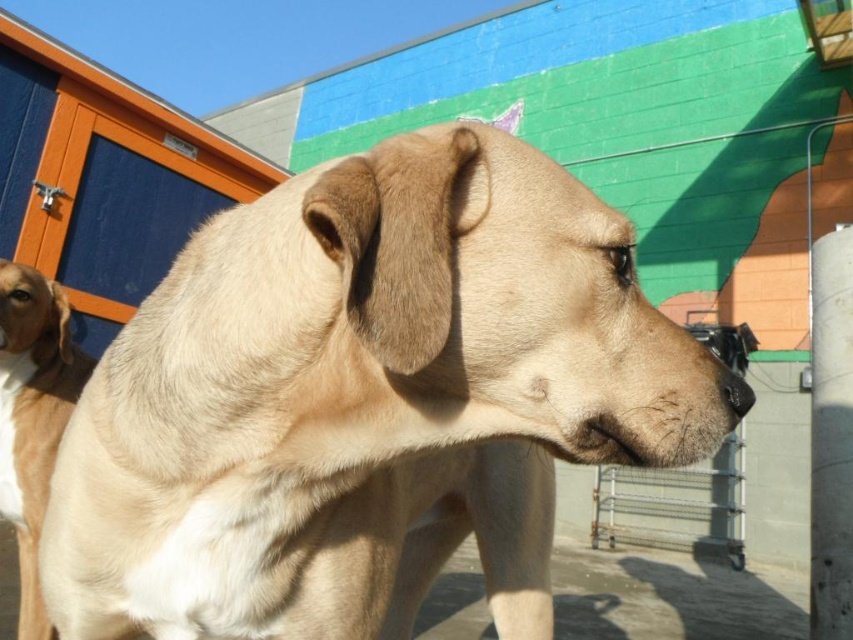
Can you confirm if fuzzy beige dog at center is wider than light brown fur at left?

Correct, the width of fuzzy beige dog at center exceeds that of light brown fur at left.

Identify the location of fuzzy beige dog at center. This screenshot has width=853, height=640. [x=367, y=401].

Between point (282, 243) and point (54, 316), which one is positioned in front?

Point (282, 243)

Find the location of a particular element. The image size is (853, 640). fuzzy beige dog at center is located at coordinates (367, 401).